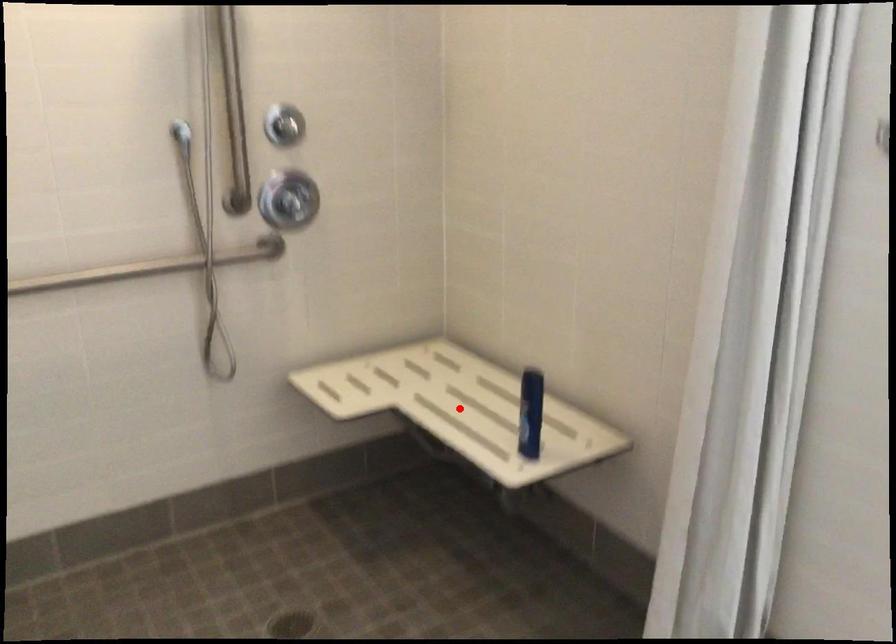
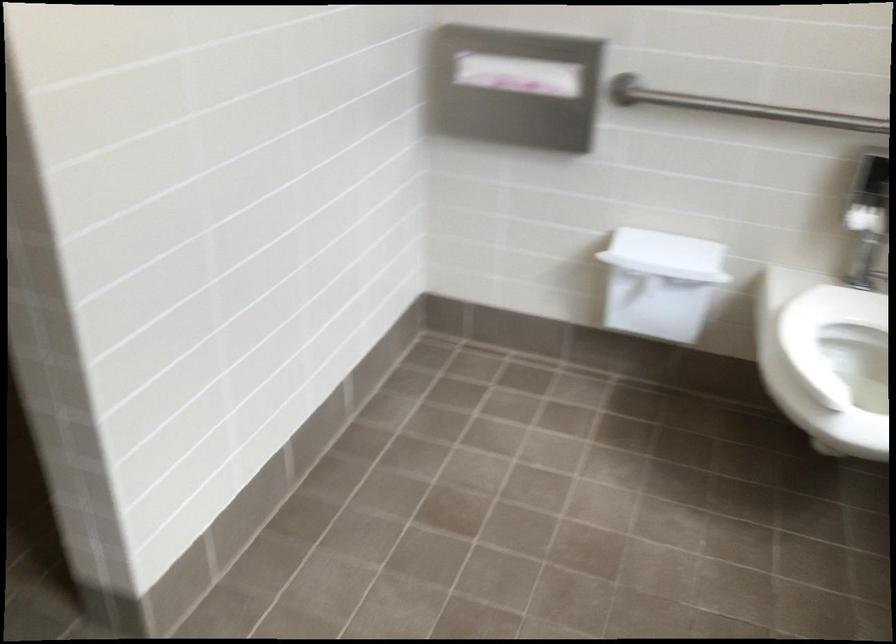
Question: I am providing you with two images of the same scene from different viewpoints. A red point is marked on the first image. Can you still see the location of the red point in image 2?

Choices:
 (A) Yes
 (B) No

Answer: (B)